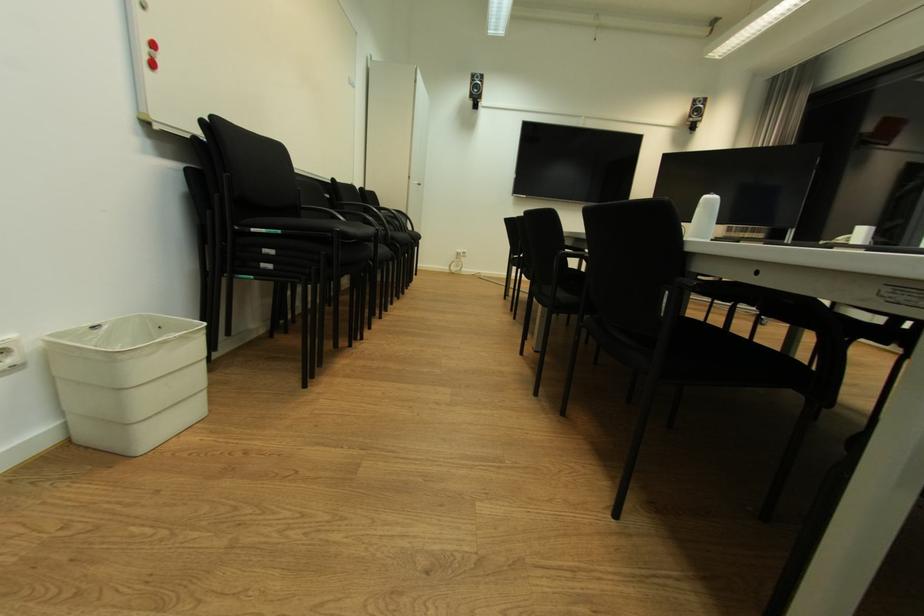
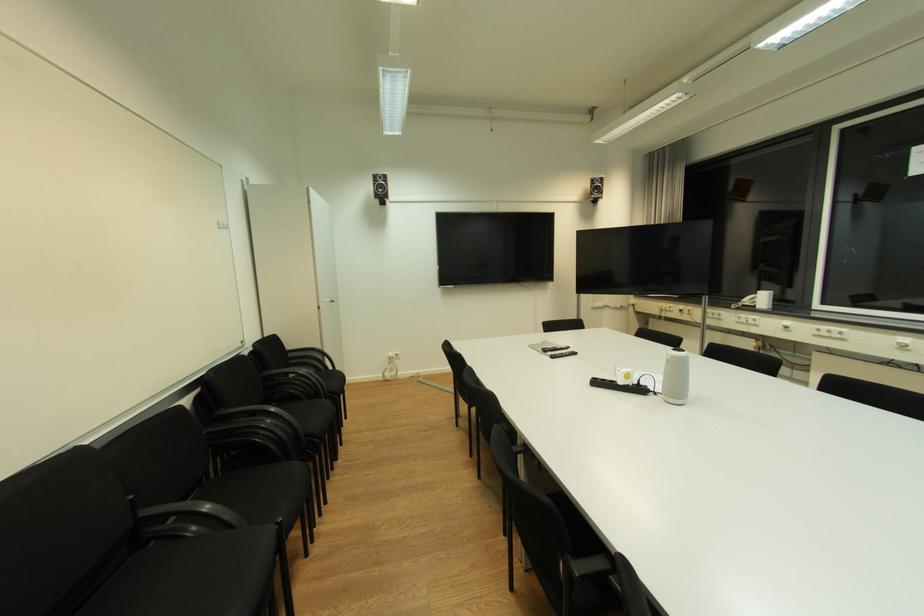
The point at (x=711, y=201) is marked in the first image. Where is the corresponding point in the second image?

(678, 358)